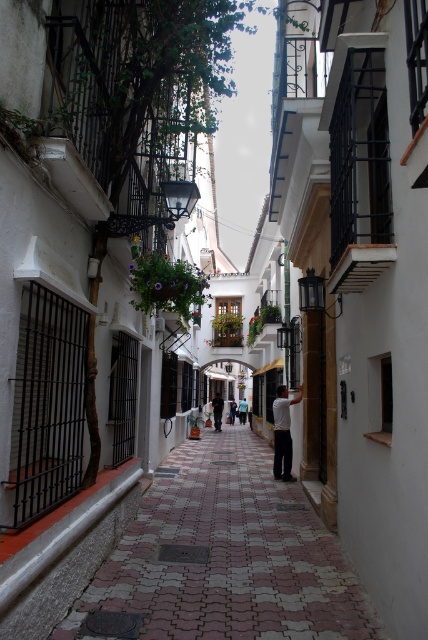
Question: Can you confirm if white matte shirt at center is smaller than light blue shirt at center?

Choices:
 (A) yes
 (B) no

Answer: (A)

Question: Which point is closer to the camera?

Choices:
 (A) light blue shirt at center
 (B) white matte shirt at center
 (C) pebble stone pavement at center

Answer: (C)

Question: Can you confirm if white matte shirt at center is positioned to the right of light blue shirt at center?

Choices:
 (A) no
 (B) yes

Answer: (A)

Question: Which object is positioned farthest from the dark gray pants at center?

Choices:
 (A) light blue shirt at center
 (B) white matte shirt at center
 (C) pebble stone pavement at center

Answer: (C)

Question: Which object is positioned closest to the pebble stone pavement at center?

Choices:
 (A) white matte shirt at center
 (B) light blue shirt at center
 (C) dark gray pants at center

Answer: (A)

Question: Is pebble stone pavement at center closer to the viewer compared to white matte shirt at center?

Choices:
 (A) no
 (B) yes

Answer: (B)